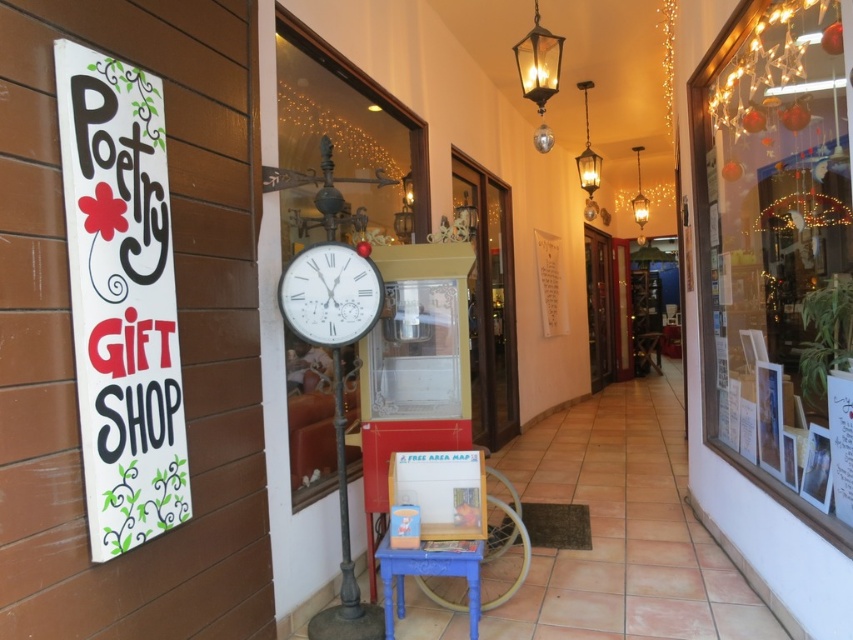
Is white painted wood sign at left above blue painted wood stool at center?

Yes.

Does white painted wood sign at left lie in front of blue painted wood stool at center?

Yes, white painted wood sign at left is in front of blue painted wood stool at center.

Between point (149, 499) and point (477, 598), which one is positioned behind?

Positioned behind is point (477, 598).

Where is `white painted wood sign at left`? The width and height of the screenshot is (853, 640). white painted wood sign at left is located at coordinates (120, 298).

In the scene shown: Does clear glass display case at right appear on the left side of white glossy clock at center?

No, clear glass display case at right is not to the left of white glossy clock at center.

Who is more forward, [704,404] or [309,310]?

Point [309,310] is more forward.

Is point (814, 200) in front of point (343, 314)?

That is False.

You are a GUI agent. You are given a task and a screenshot of the screen. Output one action in this format:
    pyautogui.click(x=<x>, y=<y>)
    Task: Click on the clear glass display case at right
    
    Given the screenshot: What is the action you would take?
    pyautogui.click(x=776, y=253)

Measure the distance from white painted wood sign at left to white glossy clock at center.

white painted wood sign at left is 29.56 inches away from white glossy clock at center.

Who is lower down, white painted wood sign at left or white glossy clock at center?

white painted wood sign at left

This screenshot has height=640, width=853. What do you see at coordinates (120, 298) in the screenshot?
I see `white painted wood sign at left` at bounding box center [120, 298].

Identify the location of white painted wood sign at left. (120, 298).